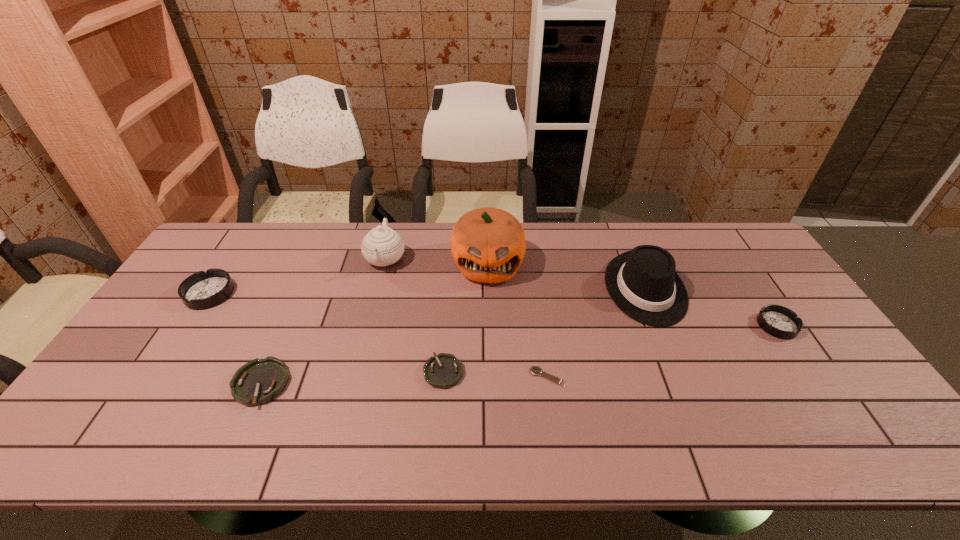
What are the coordinates of `the third ashtray from left to right` in the screenshot? It's located at (442, 371).

Identify the location of the second shortest object. pos(442,371).

Locate an element on the screen. The image size is (960, 540). watch is located at coordinates (535, 370).

Where is `vacant region located on the face of the tallest object`? The height and width of the screenshot is (540, 960). vacant region located on the face of the tallest object is located at coordinates (489, 320).

You are a GUI agent. You are given a task and a screenshot of the screen. Output one action in this format:
    pyautogui.click(x=<x>, y=<y>)
    Task: Click on the blank space located on the spout of the third object from left to right
    Image resolution: width=960 pixels, height=540 pixels.
    Given the screenshot: What is the action you would take?
    pyautogui.click(x=375, y=300)

Where is `vacant space located on the front-facing side of the third tallest object`? The image size is (960, 540). vacant space located on the front-facing side of the third tallest object is located at coordinates (680, 375).

In order to click on vacant region located 0.170m on the front of the tallest ashtray in this screenshot , I will do `click(168, 357)`.

Image resolution: width=960 pixels, height=540 pixels. In order to click on vacant region located 0.200m on the left of the rightmost ashtray in this screenshot , I will do `click(687, 325)`.

At what (x,y) coordinates should I click in order to perform the action: click on vacant space situated on the back of the seventh object from right to left. Please return your answer as a coordinate pair (x, y). The width and height of the screenshot is (960, 540). Looking at the image, I should click on (293, 312).

Locate an element on the screen. Image resolution: width=960 pixels, height=540 pixels. vacant space located on the left of the shortest ashtray is located at coordinates (276, 372).